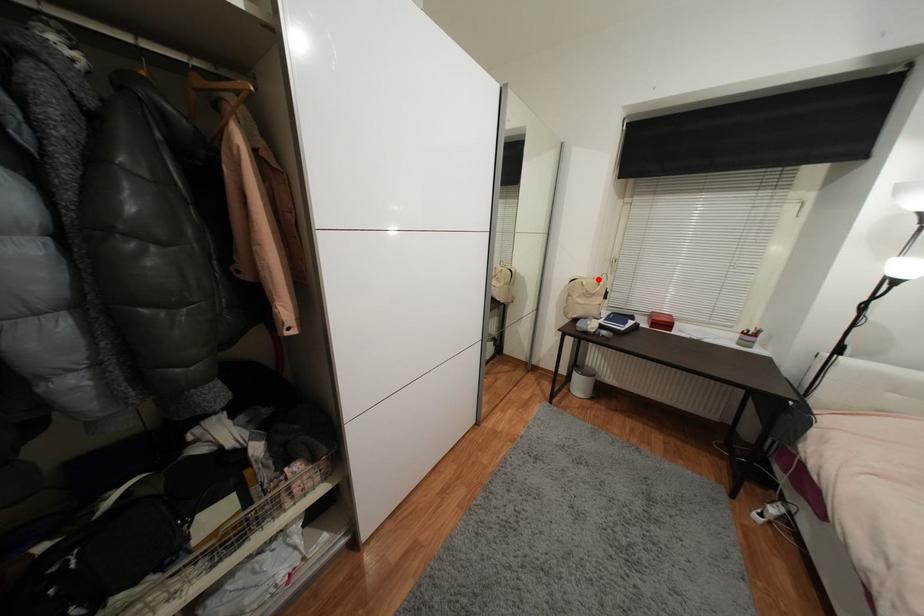
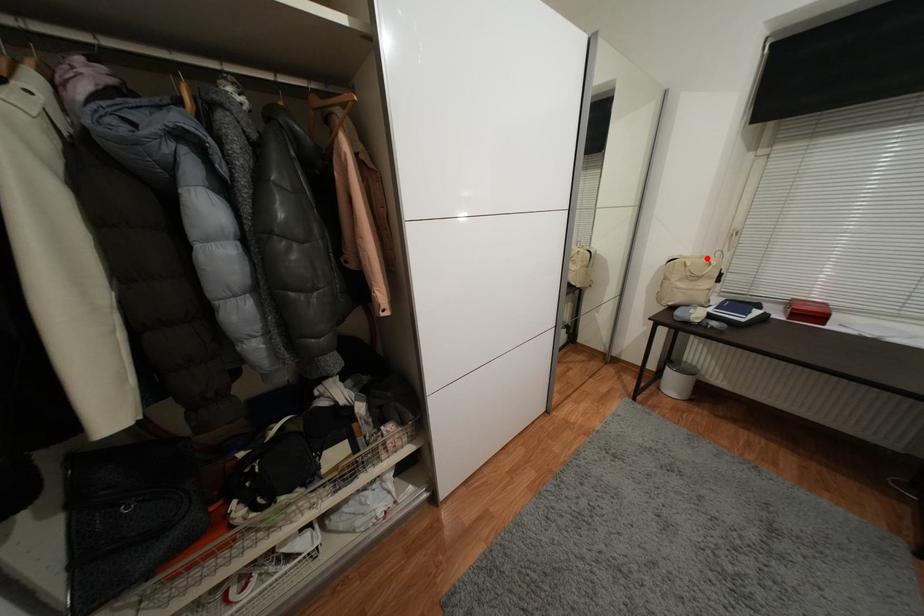
I am providing you with two images of the same scene from different viewpoints. A red point is marked on the first image and another point is marked on the second image. Is the red point in image1 aligned with the point shown in image2?

Yes